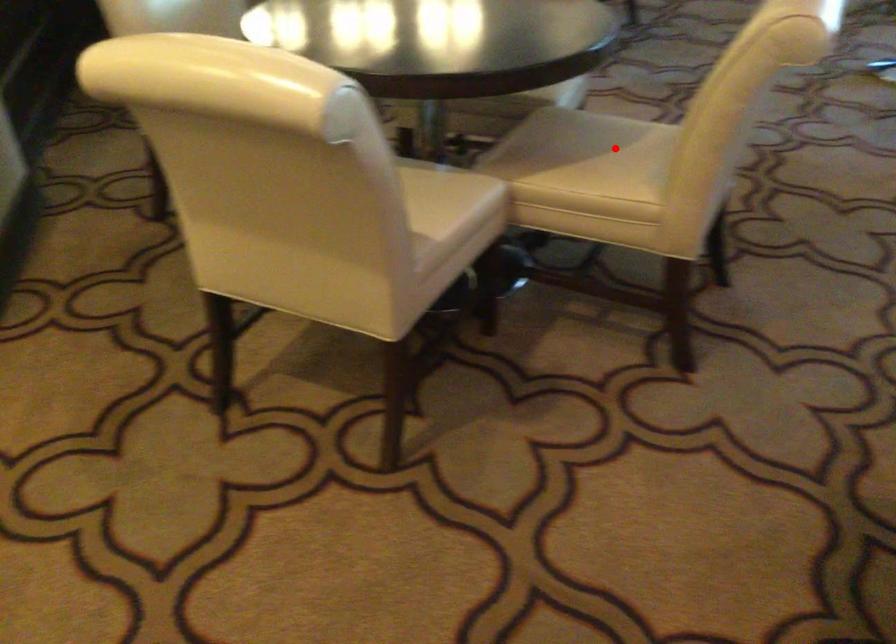
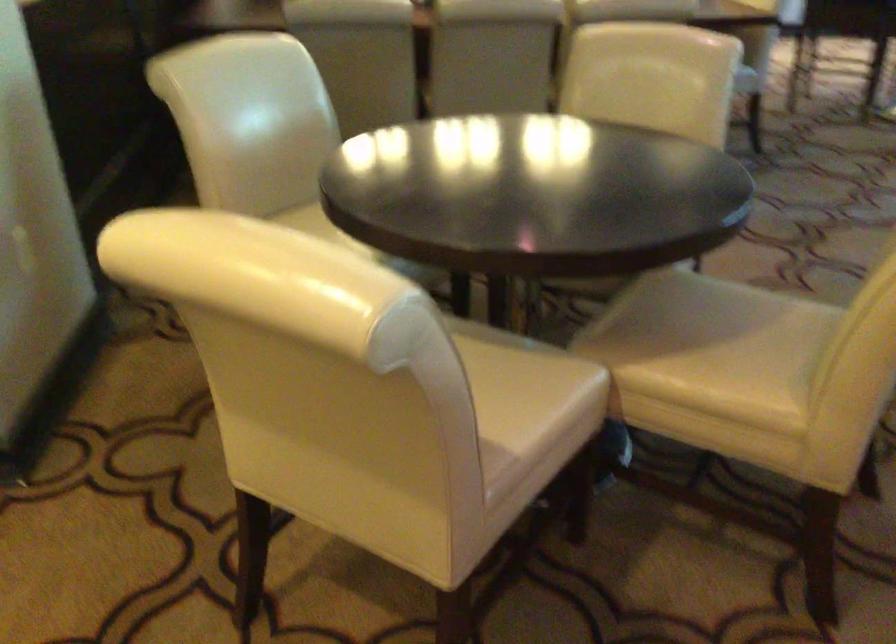
Question: I am providing you with two images of the same scene from different viewpoints. Image1 has a red point marked. In image2, the corresponding 3D location appears at what relative position? Reply with the corresponding letter.

Choices:
 (A) Closer
 (B) Farther

Answer: (A)